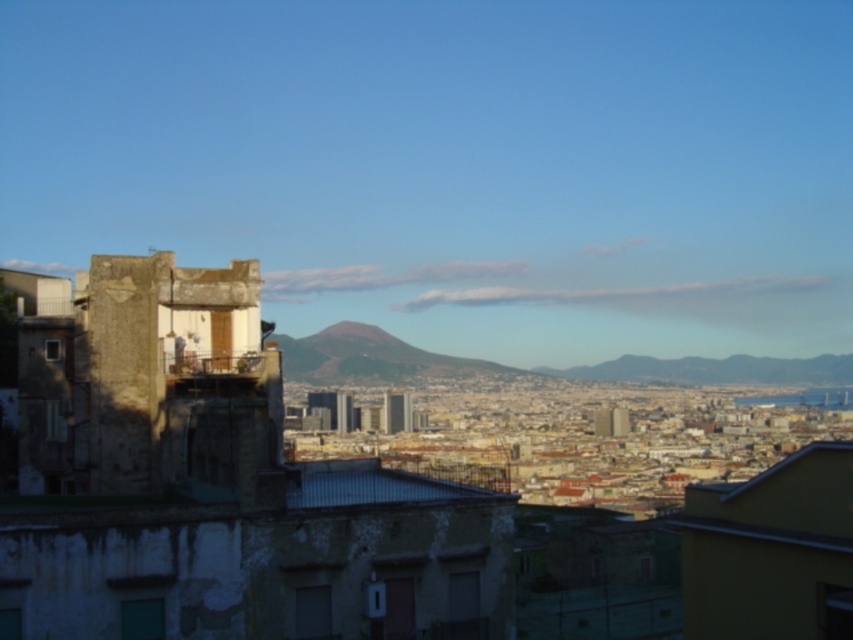
Does volcanic rock mountain at center appear over rugged stone mountain at center?

Yes.

Which is more to the left, volcanic rock mountain at center or rugged stone mountain at center?

Positioned to the left is volcanic rock mountain at center.

Does point (466, 364) lie in front of point (723, 376)?

Yes, it is.

Find the location of a particular element. volcanic rock mountain at center is located at coordinates (370, 356).